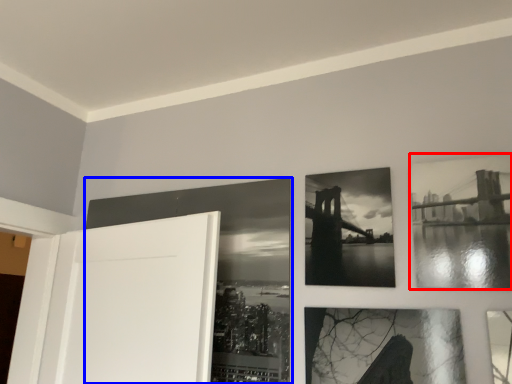
Question: Which object appears farthest to the camera in this image, picture frame (highlighted by a red box) or picture frame (highlighted by a blue box)?

Choices:
 (A) picture frame
 (B) picture frame

Answer: (B)